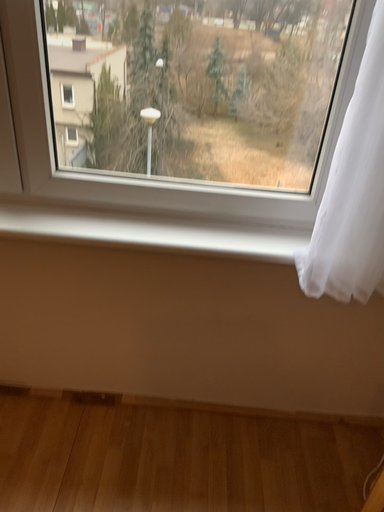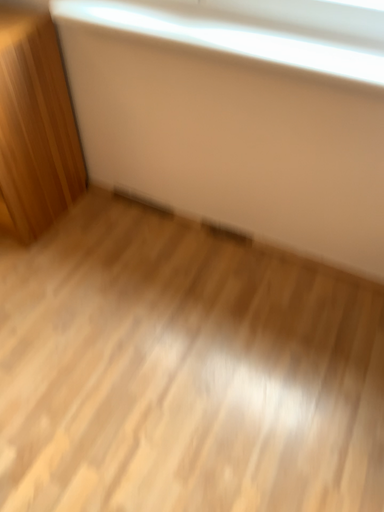
Question: How did the camera likely rotate when shooting the video?

Choices:
 (A) rotated downward
 (B) rotated upward

Answer: (A)